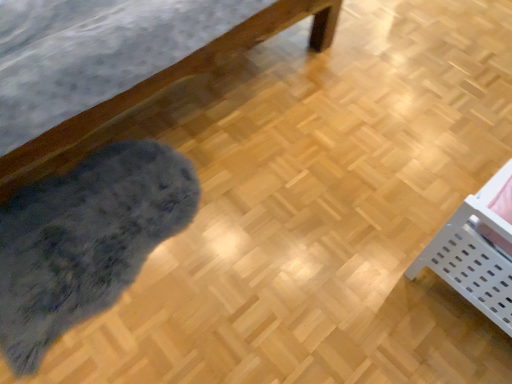
What do you see at coordinates (478, 250) in the screenshot? The height and width of the screenshot is (384, 512). I see `white plastic basket at lower right` at bounding box center [478, 250].

Locate an element on the screen. The image size is (512, 384). white plastic basket at lower right is located at coordinates (478, 250).

You are a GUI agent. You are given a task and a screenshot of the screen. Output one action in this format:
    pyautogui.click(x=<x>, y=<y>)
    Task: Click on the fuzzy gray mat at lower left
    Image resolution: width=512 pixels, height=384 pixels.
    Given the screenshot: What is the action you would take?
    pyautogui.click(x=85, y=240)

The height and width of the screenshot is (384, 512). Describe the element at coordinates (85, 240) in the screenshot. I see `fuzzy gray mat at lower left` at that location.

The image size is (512, 384). I want to click on white plastic basket at lower right, so pos(478,250).

Visually, is fuzzy gray mat at lower left positioned to the left or to the right of white plastic basket at lower right?

Based on their positions, fuzzy gray mat at lower left is located to the left of white plastic basket at lower right.

In the image, is fuzzy gray mat at lower left positioned in front of or behind white plastic basket at lower right?

In the image, fuzzy gray mat at lower left appears behind white plastic basket at lower right.

Does point (19, 268) come behind point (451, 232)?

That is True.

Looking at this image, from the image's perspective, is fuzzy gray mat at lower left on top of white plastic basket at lower right?

A: Actually, fuzzy gray mat at lower left appears below white plastic basket at lower right in the image.

From a real-world perspective, is fuzzy gray mat at lower left positioned under white plastic basket at lower right based on gravity?

Yes, from a real-world perspective, fuzzy gray mat at lower left is under white plastic basket at lower right.

Can you confirm if fuzzy gray mat at lower left is thinner than white plastic basket at lower right?

No, fuzzy gray mat at lower left is not thinner than white plastic basket at lower right.

Between fuzzy gray mat at lower left and white plastic basket at lower right, which one has more height?

With more height is white plastic basket at lower right.

Which of these two, fuzzy gray mat at lower left or white plastic basket at lower right, is bigger?

white plastic basket at lower right.

Is white plastic basket at lower right a part of fuzzy gray mat at lower left?

No, fuzzy gray mat at lower left does not contain white plastic basket at lower right.

Is fuzzy gray mat at lower left in contact with white plastic basket at lower right?

No, fuzzy gray mat at lower left is not touching white plastic basket at lower right.

Is fuzzy gray mat at lower left oriented away from white plastic basket at lower right?

fuzzy gray mat at lower left is not turned away from white plastic basket at lower right.

In the image, there is a fuzzy gray mat at lower left. At what (x,y) coordinates should I click in order to perform the action: click on furniture above it (from the image's perspective). Please return your answer as a coordinate pair (x, y). The image size is (512, 384). Looking at the image, I should click on (478, 250).

Which is more to the right, white plastic basket at lower right or fuzzy gray mat at lower left?

Positioned to the right is white plastic basket at lower right.

Is the depth of white plastic basket at lower right greater than that of fuzzy gray mat at lower left?

No.

Is point (490, 273) closer to camera compared to point (166, 223)?

Yes, point (490, 273) is in front of point (166, 223).

From the image's perspective, is white plastic basket at lower right located beneath fuzzy gray mat at lower left?

No, from the image's perspective, white plastic basket at lower right is not below fuzzy gray mat at lower left.

From a real-world perspective, is white plastic basket at lower right positioned over fuzzy gray mat at lower left based on gravity?

Correct, in the physical world, white plastic basket at lower right is higher than fuzzy gray mat at lower left.

Considering the relative sizes of white plastic basket at lower right and fuzzy gray mat at lower left in the image provided, is white plastic basket at lower right thinner than fuzzy gray mat at lower left?

Correct, the width of white plastic basket at lower right is less than that of fuzzy gray mat at lower left.

Does white plastic basket at lower right have a greater height compared to fuzzy gray mat at lower left?

Correct, white plastic basket at lower right is much taller as fuzzy gray mat at lower left.

Can you confirm if white plastic basket at lower right is bigger than fuzzy gray mat at lower left?

Yes, white plastic basket at lower right is bigger than fuzzy gray mat at lower left.

Is white plastic basket at lower right located outside fuzzy gray mat at lower left?

Yes, white plastic basket at lower right is outside of fuzzy gray mat at lower left.

Is white plastic basket at lower right next to fuzzy gray mat at lower left and touching it?

No, white plastic basket at lower right is not beside fuzzy gray mat at lower left.

Is white plastic basket at lower right positioned with its back to fuzzy gray mat at lower left?

No, white plastic basket at lower right's orientation is not away from fuzzy gray mat at lower left.

How much distance is there between white plastic basket at lower right and fuzzy gray mat at lower left?

white plastic basket at lower right is 3.30 feet from fuzzy gray mat at lower left.

At what (x,y) coordinates should I click in order to perform the action: click on furniture that appears above the fuzzy gray mat at lower left (from the image's perspective). Please return your answer as a coordinate pair (x, y). This screenshot has height=384, width=512. Looking at the image, I should click on (478, 250).

Identify the location of mat behind the white plastic basket at lower right. The width and height of the screenshot is (512, 384). (85, 240).

Where is `mat on the left of white plastic basket at lower right`? The image size is (512, 384). mat on the left of white plastic basket at lower right is located at coordinates (85, 240).